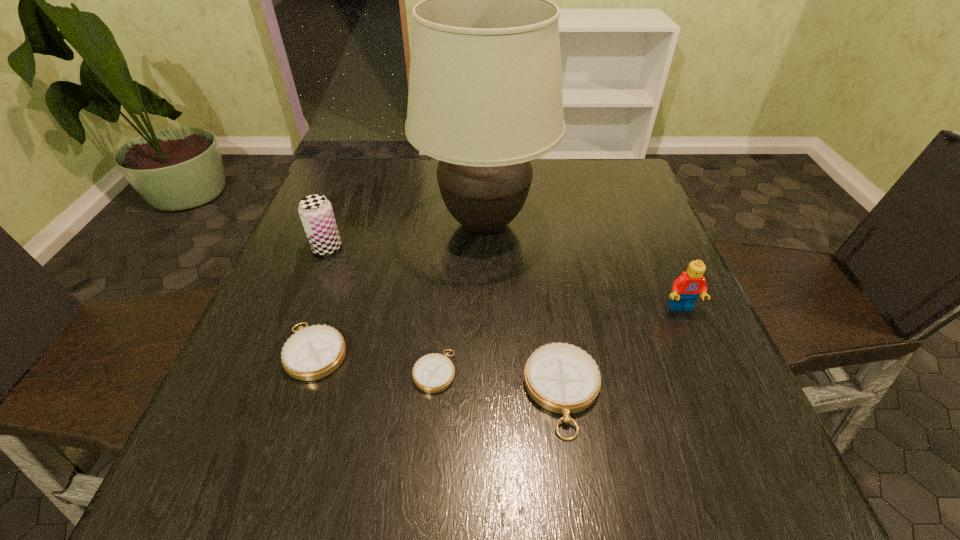
All compasss are currently evenly spaced. To continue this pattern, where would you add another compass on the right? Please point out a vacant spot. Please provide its 2D coordinates. Your answer should be formatted as a tuple, i.e. [(x, y)], where the tuple contains the x and y coordinates of a point satisfying the conditions above.

[(702, 416)]